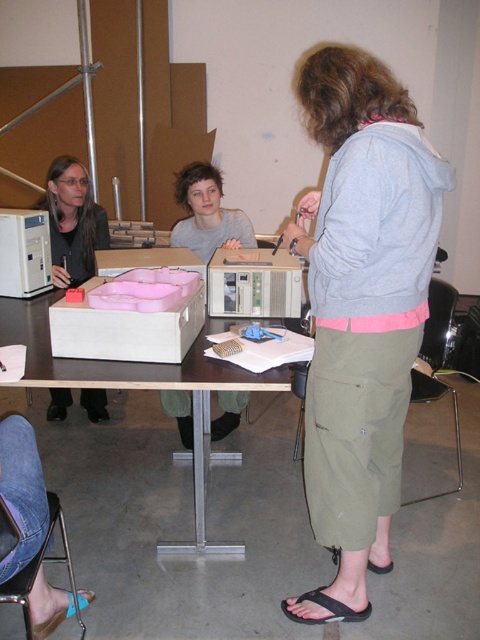
Question: Among these points, which one is nearest to the camera?

Choices:
 (A) (255, 378)
 (B) (382, 532)
 (C) (63, 211)

Answer: (A)

Question: In this image, where is matte black laptop at left located relative to denim fabric stool at lower left?

Choices:
 (A) below
 (B) above

Answer: (B)

Question: Estimate the real-world distances between objects in this image. Which object is farther from the denim fabric stool at lower left?

Choices:
 (A) matte gray shirt at center
 (B) matte plastic box at center
 (C) gray cotton hoodie at upper right

Answer: (A)

Question: Can you confirm if wooden table at center is positioned below black fabric sandal at lower center?

Choices:
 (A) no
 (B) yes

Answer: (A)

Question: Which point appears closest to the camera in this image?

Choices:
 (A) (59, 161)
 (B) (225, 381)
 (C) (333, 554)
 (D) (49, 627)

Answer: (D)

Question: Is wooden table at center above black fabric sandal at lower center?

Choices:
 (A) yes
 (B) no

Answer: (A)